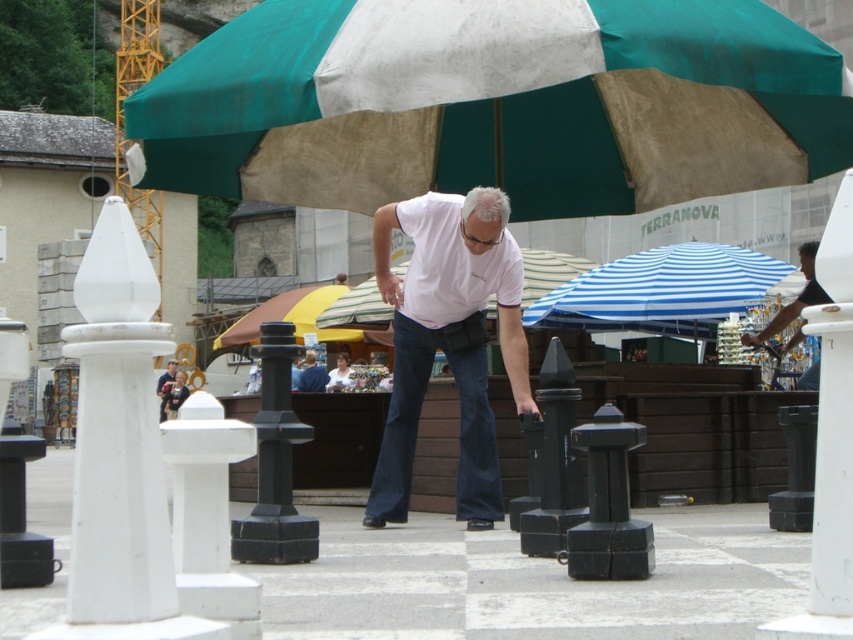
Question: Which point is closer to the camera?

Choices:
 (A) blue striped fabric umbrella at center
 (B) black fabric umbrella at upper right
 (C) green fabric umbrella at upper center

Answer: (C)

Question: Does white matte shirt at center appear over blue striped fabric umbrella at center?

Choices:
 (A) yes
 (B) no

Answer: (B)

Question: Does white matte shirt at center appear on the right side of white striped umbrella at center?

Choices:
 (A) no
 (B) yes

Answer: (A)

Question: Can you confirm if green fabric umbrella at upper center is thinner than black fabric umbrella at upper right?

Choices:
 (A) yes
 (B) no

Answer: (B)

Question: Estimate the real-world distances between objects in this image. Which object is closer to the white striped umbrella at center?

Choices:
 (A) blue striped fabric umbrella at center
 (B) black fabric umbrella at upper right
 (C) white matte shirt at center

Answer: (A)

Question: Which of the following is the closest to the observer?

Choices:
 (A) [782, 348]
 (B) [694, 250]

Answer: (A)